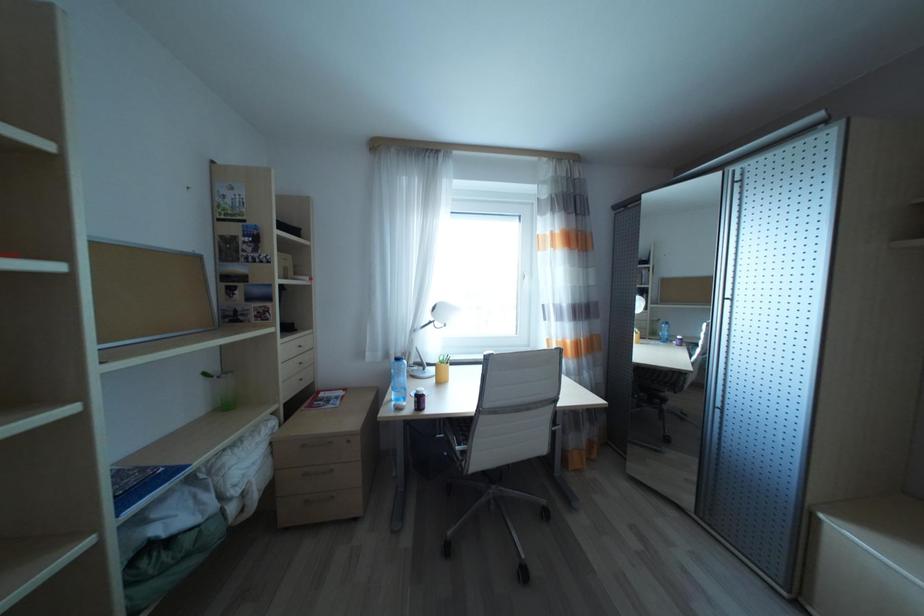
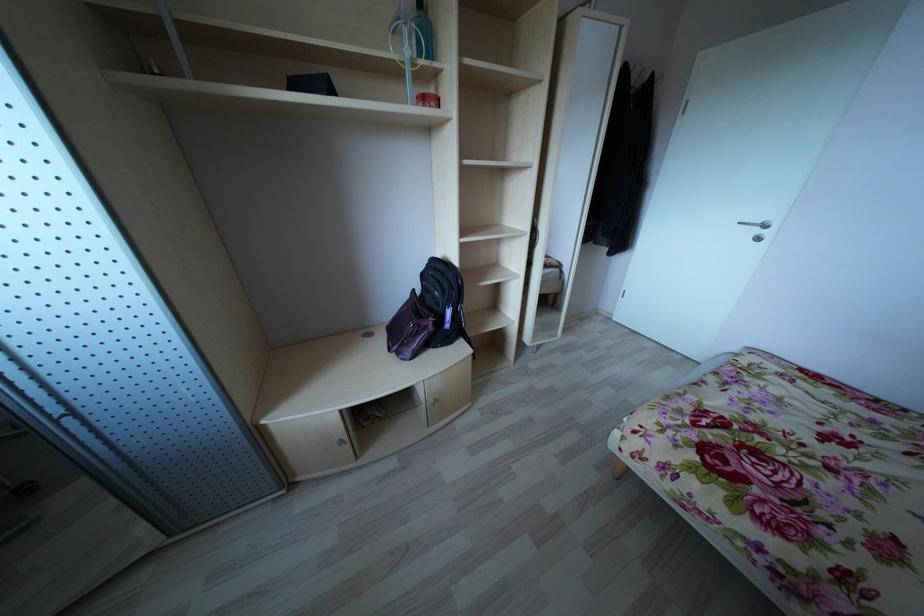
In the scene shown: First-person continuous shooting, in which direction is the camera rotating?

The camera's rotation is toward right-down.